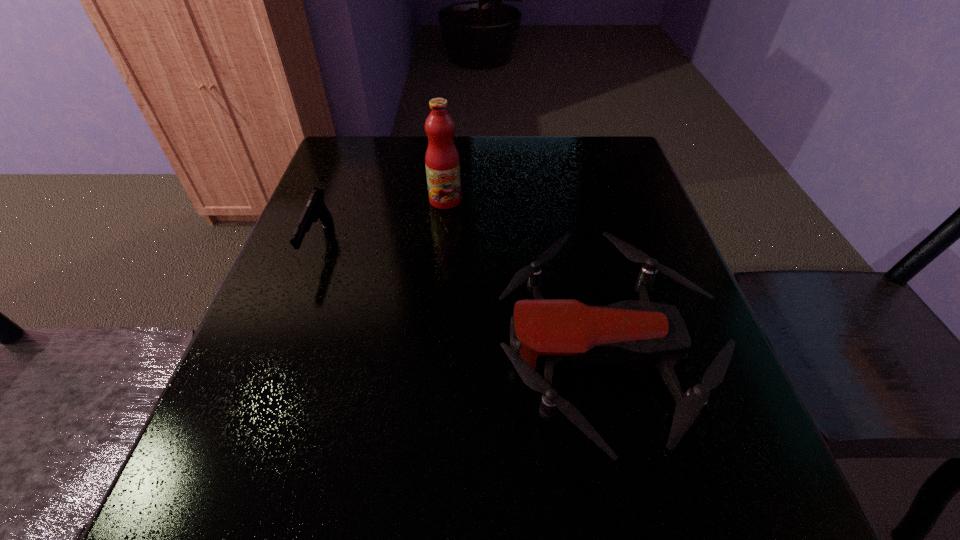
At what (x,y) coordinates should I click in order to perform the action: click on unoccupied position between the drone and the leftmost object. Please return your answer as a coordinate pair (x, y). The image size is (960, 540). Looking at the image, I should click on (461, 297).

This screenshot has height=540, width=960. I want to click on vacant point located between the rightmost object and the leftmost object, so click(461, 297).

The width and height of the screenshot is (960, 540). I want to click on free space between the gun and the rightmost object, so click(x=461, y=297).

Identify the location of free space between the leftmost object and the fruit juice. The width and height of the screenshot is (960, 540). (382, 222).

Where is `free space between the second object from left to right and the gun`? The width and height of the screenshot is (960, 540). free space between the second object from left to right and the gun is located at coordinates (382, 222).

You are a GUI agent. You are given a task and a screenshot of the screen. Output one action in this format:
    pyautogui.click(x=<x>, y=<y>)
    Task: Click on the object that is the closest to the drone
    
    Given the screenshot: What is the action you would take?
    pyautogui.click(x=442, y=161)

The image size is (960, 540). What are the coordinates of `object that is the second closest one to the tallest object` in the screenshot? It's located at (315, 209).